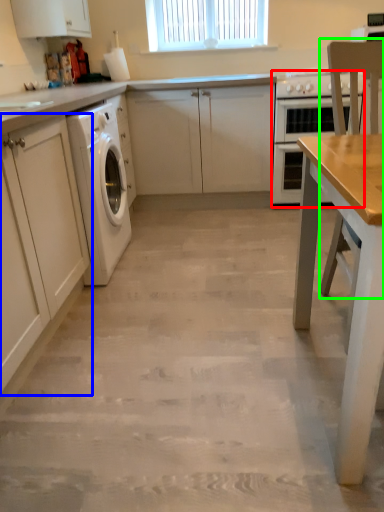
Question: Which object is positioned farthest from home appliance (highlighted by a red box)? Select from cabinetry (highlighted by a blue box) and chair (highlighted by a green box).

Choices:
 (A) cabinetry
 (B) chair

Answer: (A)